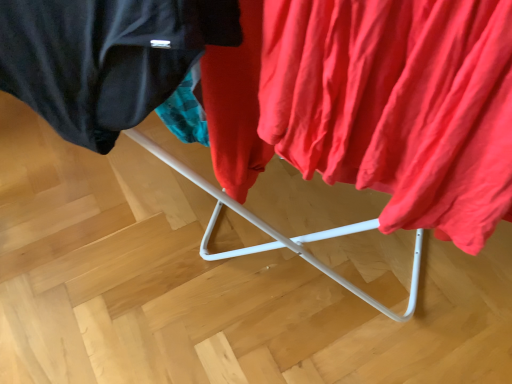
Question: In terms of height, does matte black jacket at upper left look taller or shorter compared to matte red fabric at right?

Choices:
 (A) short
 (B) tall

Answer: (A)

Question: Would you say matte black jacket at upper left is inside or outside matte red fabric at right?

Choices:
 (A) inside
 (B) outside

Answer: (B)

Question: From the image's perspective, is matte black jacket at upper left positioned above or below matte red fabric at right?

Choices:
 (A) below
 (B) above

Answer: (B)

Question: Considering the relative positions of matte red fabric at right and matte black jacket at upper left in the image provided, is matte red fabric at right to the left or to the right of matte black jacket at upper left?

Choices:
 (A) right
 (B) left

Answer: (A)

Question: Considering the positions of matte red fabric at right and matte black jacket at upper left in the image, is matte red fabric at right bigger or smaller than matte black jacket at upper left?

Choices:
 (A) big
 (B) small

Answer: (A)

Question: Looking at their shapes, would you say matte red fabric at right is wider or thinner than matte black jacket at upper left?

Choices:
 (A) thin
 (B) wide

Answer: (B)

Question: Is matte red fabric at right inside the boundaries of matte black jacket at upper left, or outside?

Choices:
 (A) inside
 (B) outside

Answer: (B)